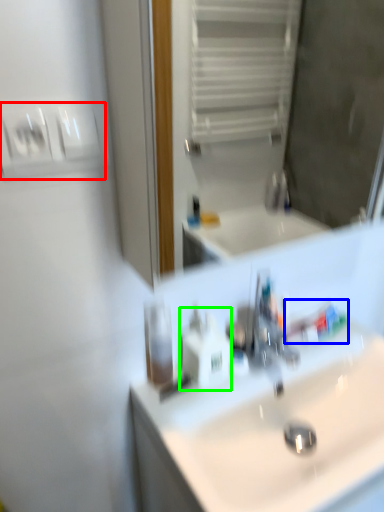
Question: Which object is positioned farthest from light switch (highlighted by a red box)? Select from toothpaste (highlighted by a blue box) and soap dispenser (highlighted by a green box).

Choices:
 (A) toothpaste
 (B) soap dispenser

Answer: (A)